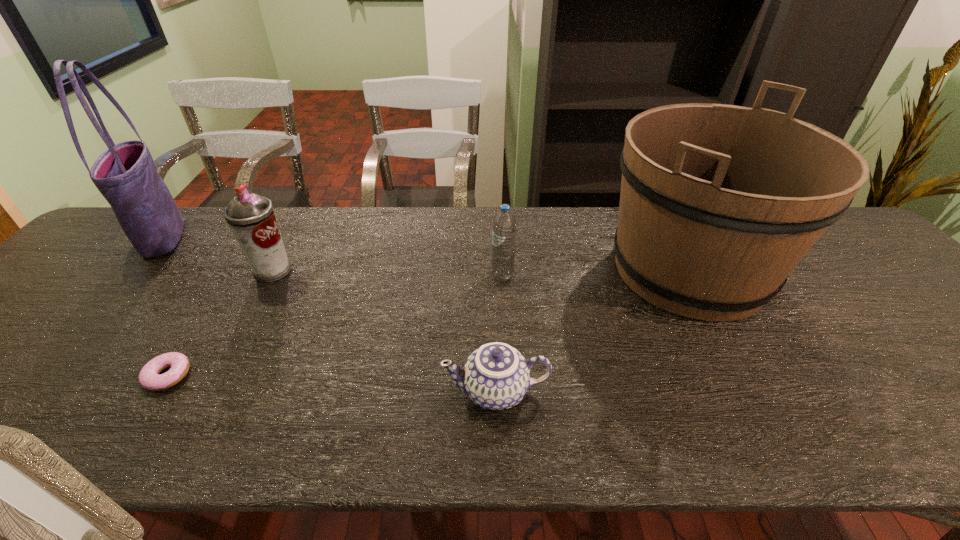
Locate an element on the screen. the leftmost object is located at coordinates (125, 174).

Where is `the rightmost object`? This screenshot has height=540, width=960. the rightmost object is located at coordinates (719, 203).

Identify the location of aerosol can. The image size is (960, 540). (251, 218).

Where is `the third object from left to right`? This screenshot has width=960, height=540. the third object from left to right is located at coordinates (251, 218).

Where is `the third shortest object`? The height and width of the screenshot is (540, 960). the third shortest object is located at coordinates 504,225.

The image size is (960, 540). What are the coordinates of `chinaware` in the screenshot? It's located at (496, 376).

Locate an element on the screen. This screenshot has width=960, height=540. the shortest object is located at coordinates (149, 378).

Where is `doughnut`? This screenshot has width=960, height=540. doughnut is located at coordinates (149, 378).

This screenshot has height=540, width=960. I want to click on free location located on the front of the leftmost object, so click(107, 299).

Locate an element on the screen. The height and width of the screenshot is (540, 960). free region located 0.400m on the left of the rightmost object is located at coordinates (452, 271).